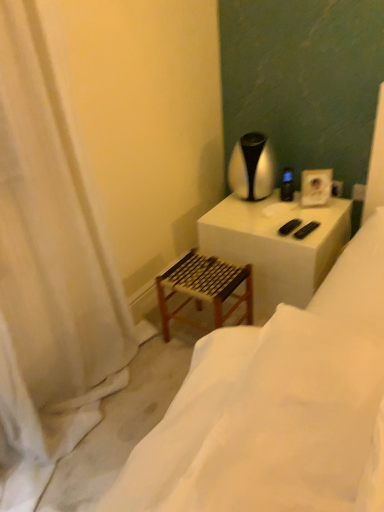
At what (x,y) coordinates should I click in order to perform the action: click on free space above white matte table at upper right (from a real-world perspective). Please return your answer as a coordinate pair (x, y). Image resolution: width=384 pixels, height=512 pixels. Looking at the image, I should click on (276, 211).